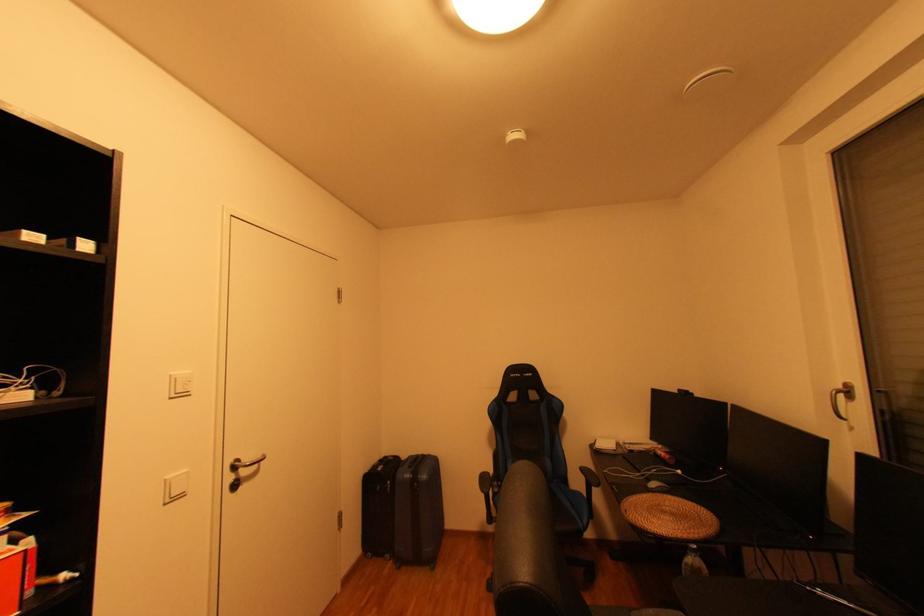
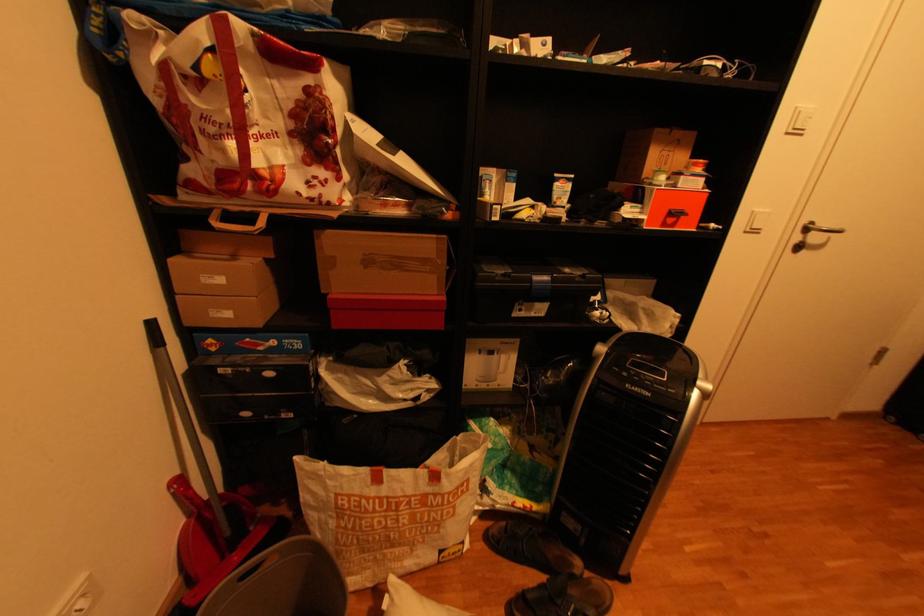
First-person continuous shooting, in which direction is the camera rotating?

The camera rotated toward left-down.